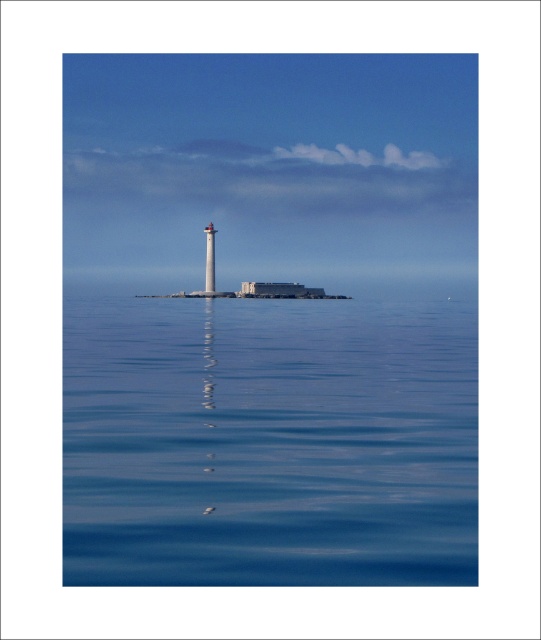
What do you see at coordinates (268, 442) in the screenshot?
I see `smooth blue water at center` at bounding box center [268, 442].

This screenshot has width=541, height=640. Identify the location of smooth blue water at center. (268, 442).

Find the location of a particular element. This screenshot has width=541, height=640. smooth blue water at center is located at coordinates (268, 442).